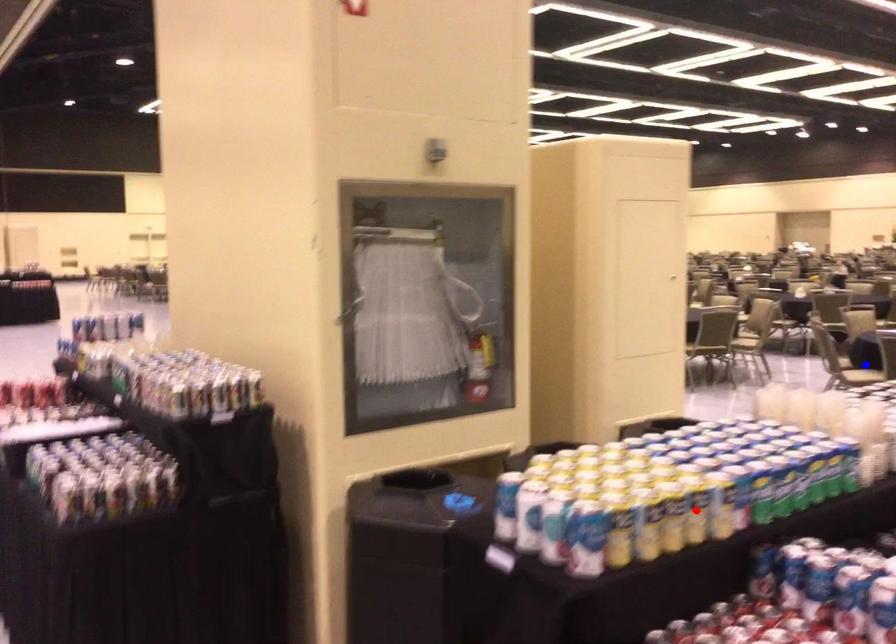
Question: In the image, two points are highlighted. Which point is nearer to the camera? Reply with the corresponding letter.

Choices:
 (A) blue point
 (B) red point

Answer: (B)